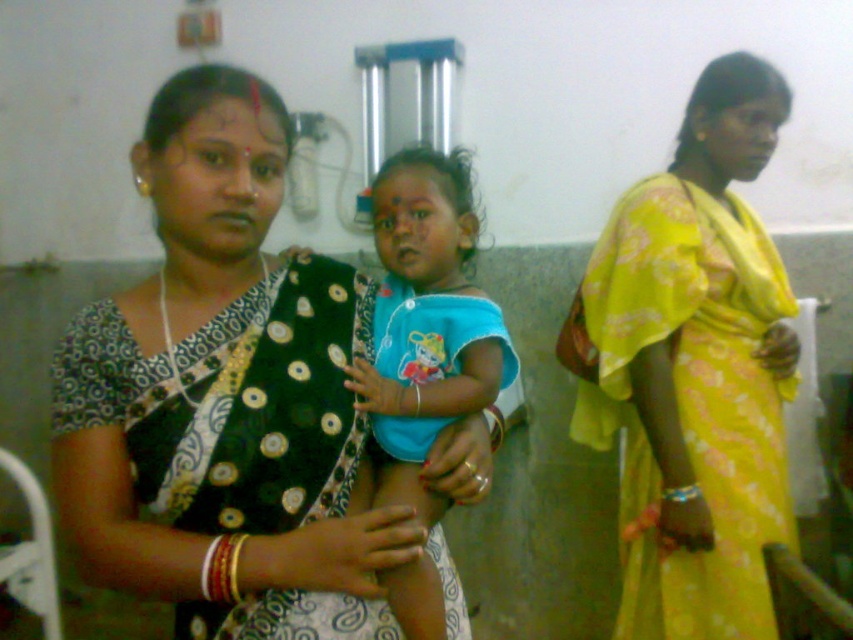
You are a photographer setting up for a family portrait in a hospital room. You have two sarees present in the scene, the black satin saree at center and the yellow floral saree at right. Which saree takes up more space in the image?

The yellow floral saree at right takes up more space in the image than the black satin saree at center because the black satin saree at center occupies less space than yellow floral saree at right.

You are a photographer standing at a distance of 30 inches from the camera. You want to take a photo of the black satin saree at center. Can you reach it without moving closer?

The black satin saree at center is 34.70 inches away from the camera, which is farther than your current position of 30 inches. Therefore, you need to move closer to reach it.

You are a photographer trying to capture a detailed shot of two specific points in the image. The first point is at coordinate point(206,579) and the second is at point(445,621). Since you want to focus on the point closer to you, which coordinate should you choose?

Point(206,579) is closer to the camera than point(445,621), so you should choose point(206,579) to focus on.